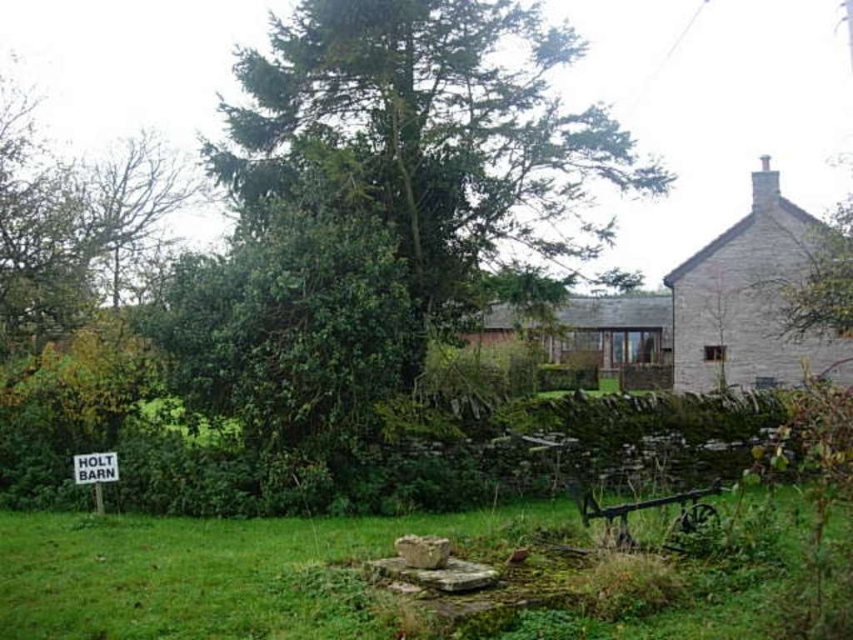
You are standing at the entrance of the stone barn and see two points marked in the image. The first point is at coordinate point(762, 180) and the second is at point(589, 308). Which point is closer to you?

Point(762, 180) is closer to you because it is in front of point(589, 308).

From the picture: You are standing in front of the barn and notice two points marked on the ground. The first point is at coordinates point (453, 92) and the second is at point (97, 460). If you want to place a new flower bed closer to you, which point should you choose?

Point (453, 92) is further to the viewer than point (97, 460), so you should choose point (453, 92) for the flower bed since it is closer to you.